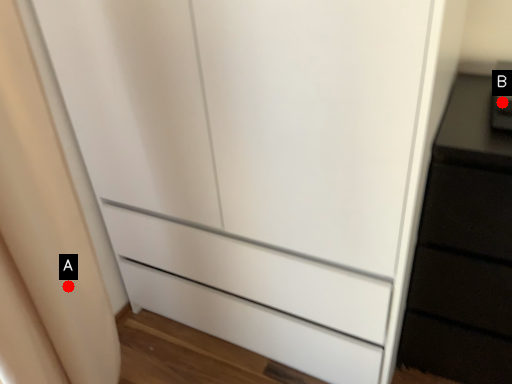
Question: Two points are circled on the image, labeled by A and B beside each circle. Which point appears closest to the camera in this image?

Choices:
 (A) A is closer
 (B) B is closer

Answer: (A)